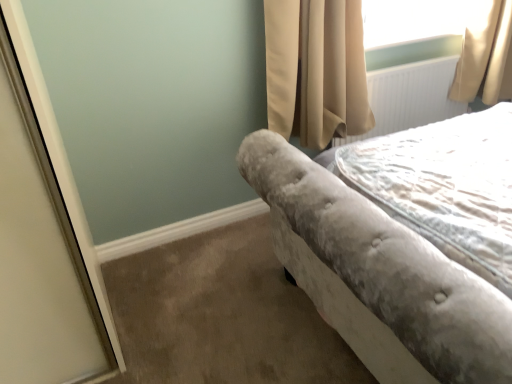
Find the location of a particular element. empty space that is ontop of white textured radiator at upper right (from a real-world perspective) is located at coordinates point(412,57).